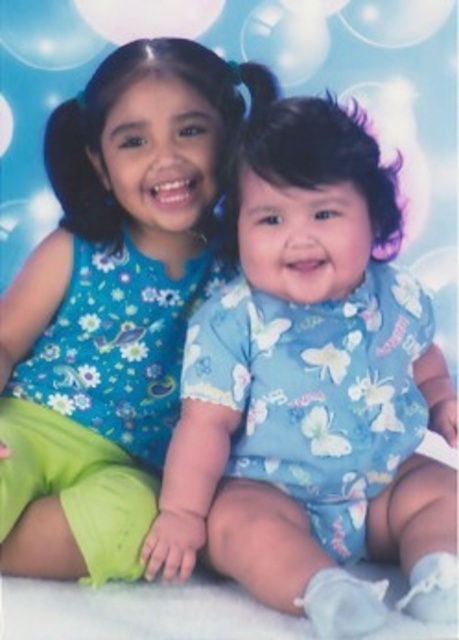
Which is in front, point (77, 404) or point (110, 38)?

Point (77, 404) is more forward.

Between point (134, 209) and point (174, 17), which one is positioned in front?

Positioned in front is point (134, 209).

The height and width of the screenshot is (640, 459). In order to click on floral fabric dress at upper left in this screenshot , I will do `click(129, 221)`.

Can you confirm if blue fabric baby at center is thinner than floral fabric dress at upper left?

No.

Between point (197, 429) and point (147, 209), which one is positioned behind?

Positioned behind is point (147, 209).

Who is more forward, (230,529) or (167,410)?

Positioned in front is point (230,529).

Where is `blue fabric baby at center`? This screenshot has height=640, width=459. blue fabric baby at center is located at coordinates (313, 392).

Who is more forward, (x=329, y=492) or (x=184, y=33)?

Positioned in front is point (x=329, y=492).

Describe the element at coordinates (313, 392) in the screenshot. I see `blue fabric baby at center` at that location.

Who is more forward, (242, 253) or (161, 12)?

Point (242, 253)

Identify the location of blue fabric baby at center. This screenshot has height=640, width=459. (313, 392).